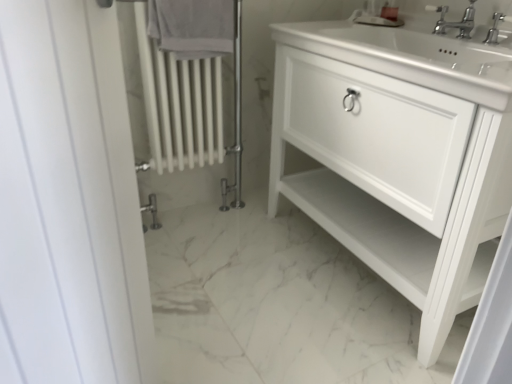
Question: Based on their positions, is white cotton towel at upper center located to the left or right of white matte cabinet at center?

Choices:
 (A) right
 (B) left

Answer: (B)

Question: Choose the correct answer: Is white cotton towel at upper center inside white matte cabinet at center or outside it?

Choices:
 (A) inside
 (B) outside

Answer: (B)

Question: Which of these objects is positioned closest to the white cotton towel at upper center?

Choices:
 (A) polished chrome faucet at upper right, the first tap viewed from the right
 (B) clear plastic soap dispenser at upper center
 (C) polished chrome faucet at upper right, marked as the first tap in a left-to-right arrangement
 (D) white matte cabinet at center

Answer: (D)

Question: Estimate the real-world distances between objects in this image. Which object is farther from the clear plastic soap dispenser at upper center?

Choices:
 (A) white matte cabinet at center
 (B) polished chrome faucet at upper right, marked as the first tap in a left-to-right arrangement
 (C) polished chrome faucet at upper right, the first tap viewed from the right
 (D) white cotton towel at upper center

Answer: (D)